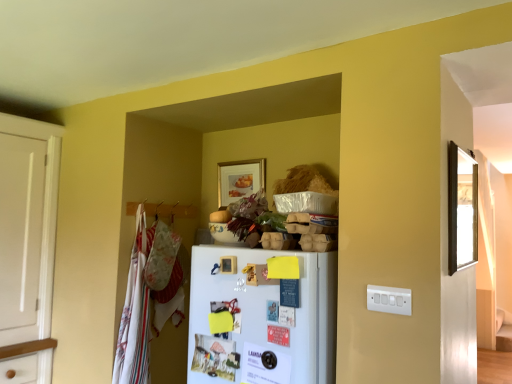
Question: Is white matte refrigerator at center taller or shorter than matte wooden picture frame at upper center, the first picture frame in the left-to-right sequence?

Choices:
 (A) short
 (B) tall

Answer: (B)

Question: From the image's perspective, relative to matte wooden picture frame at upper center, the 2th picture frame viewed from the right, is white matte refrigerator at center above or below?

Choices:
 (A) above
 (B) below

Answer: (B)

Question: Which object is positioned farthest from the matte wooden picture frame at upper center, positioned as the second picture frame in front-to-back order?

Choices:
 (A) wooden mirror at right, positioned as the 2th picture frame in left-to-right order
 (B) white matte refrigerator at center
 (C) white cotton laundry at left
 (D) white plastic switch plate at lower right

Answer: (D)

Question: Estimate the real-world distances between objects in this image. Which object is farther from the white plastic switch plate at lower right?

Choices:
 (A) white cotton laundry at left
 (B) white matte refrigerator at center
 (C) wooden mirror at right, the 1th picture frame viewed from the right
 (D) matte wooden picture frame at upper center, the 2th picture frame viewed from the right

Answer: (A)